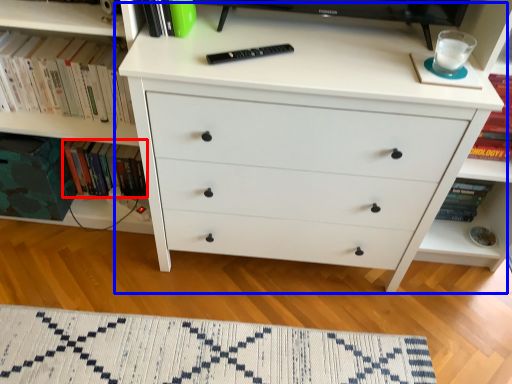
Question: Which object is further to the camera taking this photo, book (highlighted by a red box) or chest of drawers (highlighted by a blue box)?

Choices:
 (A) book
 (B) chest of drawers

Answer: (A)